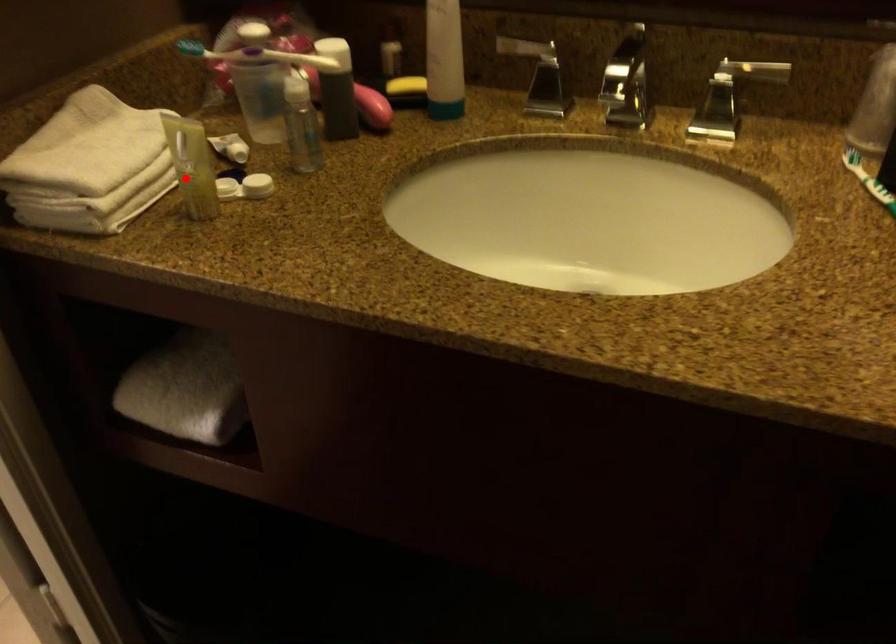
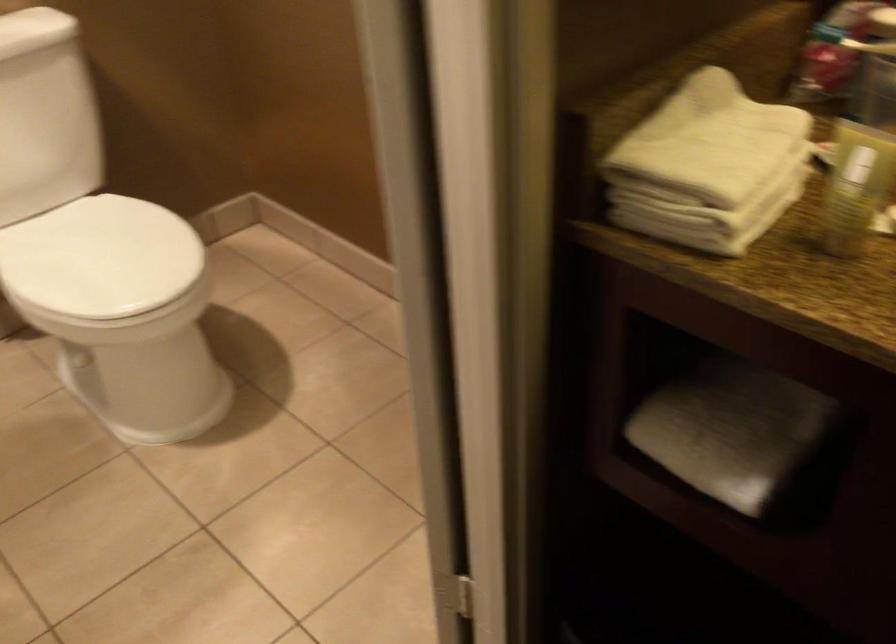
Where in the second image is the point corresponding to the highlighted location from the first image?

(849, 204)